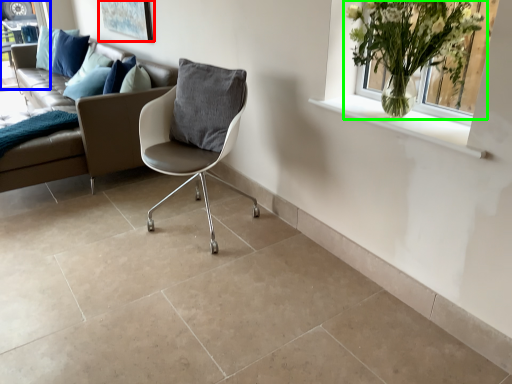
Question: Which is farther away from picture frame (highlighted by a red box)? window frame (highlighted by a blue box) or houseplant (highlighted by a green box)?

Choices:
 (A) window frame
 (B) houseplant

Answer: (B)